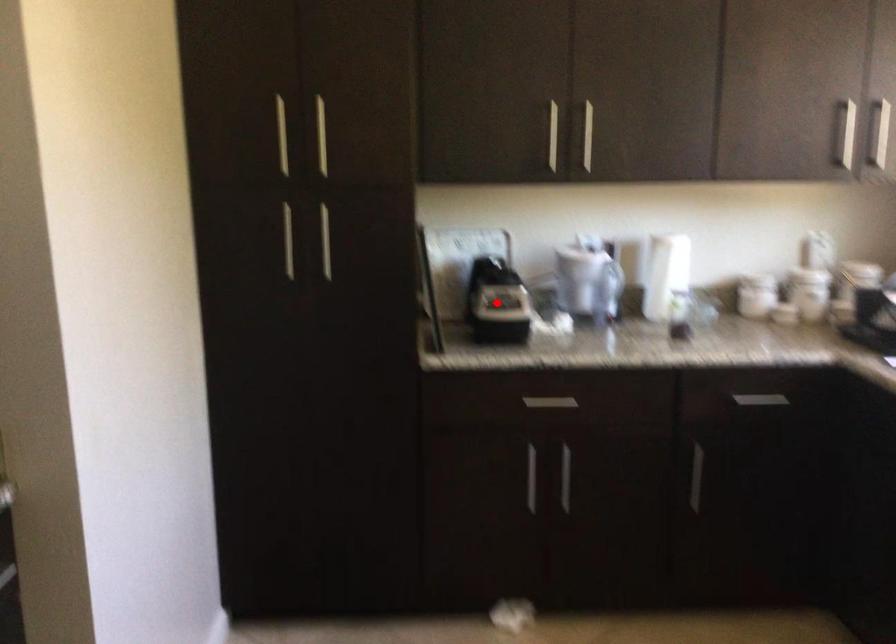
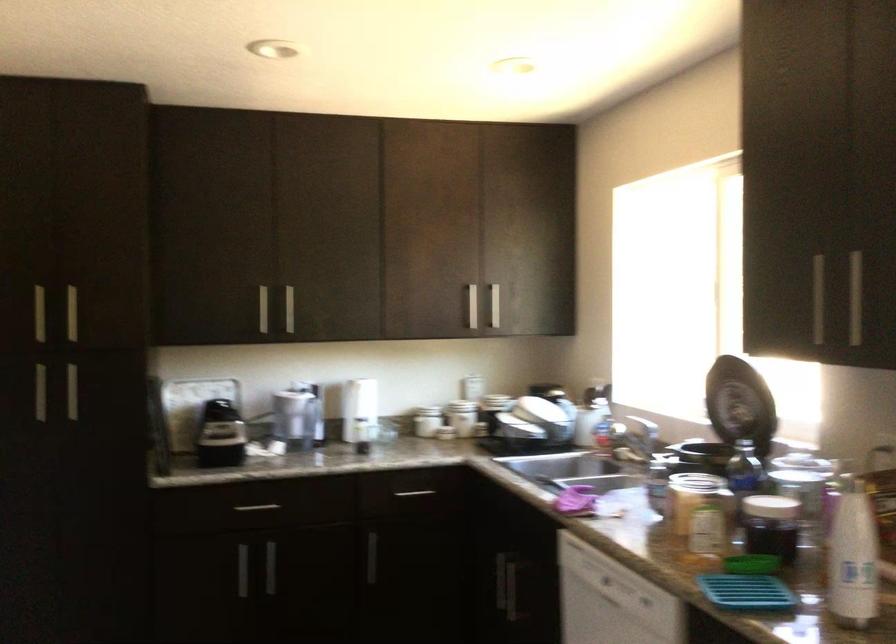
In the second image, find the point that corresponds to the highlighted location in the first image.

(220, 435)